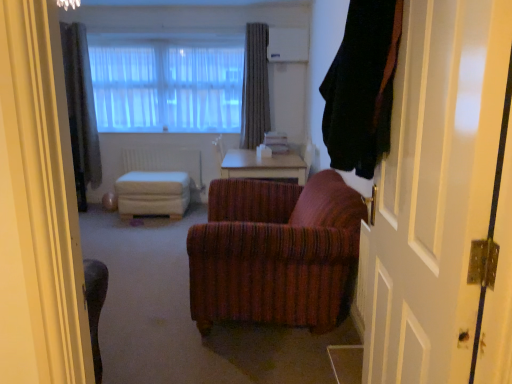
What is the approximate height of light brown wooden table at center?

It is 18.12 inches.

Where is `white matte radiator at center`? The height and width of the screenshot is (384, 512). white matte radiator at center is located at coordinates (165, 161).

From the picture: Measure the distance between point [251,123] and camera.

Point [251,123] is 16.53 feet from camera.

Identify the location of white fabric ottoman at center. (153, 194).

You are a GUI agent. You are given a task and a screenshot of the screen. Output one action in this format:
    pyautogui.click(x=<x>, y=<y>)
    Task: Click on the light brown wooden table at center
    This screenshot has height=384, width=512.
    Given the screenshot: What is the action you would take?
    pyautogui.click(x=263, y=166)

In terms of size, does white painted wood door at right appear bigger or smaller than black fabric curtain at right, which appears as the 1th curtain when viewed from the right?

white painted wood door at right is bigger than black fabric curtain at right, which appears as the 1th curtain when viewed from the right.

Does point (420, 382) come behind point (349, 44)?

No, (420, 382) is closer to viewer.

From a real-world perspective, which is physically below, white painted wood door at right or black fabric curtain at right, positioned as the 3th curtain in left-to-right order?

white painted wood door at right, from a real-world perspective.

What's the angular difference between white painted wood door at right and black fabric curtain at right, which is counted as the third curtain, starting from the back,'s facing directions?

They differ by 10.1 degrees in their facing directions.

Is gray textured curtain at upper center, arranged as the first curtain when viewed from the back, aimed at gray textured curtain at upper left, placed as the third curtain when sorted from right to left?

No, gray textured curtain at upper center, arranged as the first curtain when viewed from the back, does not turn towards gray textured curtain at upper left, placed as the third curtain when sorted from right to left.

In terms of height, does gray textured curtain at upper center, placed as the 3th curtain when sorted from front to back, look taller or shorter compared to gray textured curtain at upper left, marked as the first curtain in a left-to-right arrangement?

Considering their sizes, gray textured curtain at upper center, placed as the 3th curtain when sorted from front to back, has less height than gray textured curtain at upper left, marked as the first curtain in a left-to-right arrangement.

Is gray textured curtain at upper center, arranged as the first curtain when viewed from the back, touching gray textured curtain at upper left, marked as the first curtain in a left-to-right arrangement?

gray textured curtain at upper center, arranged as the first curtain when viewed from the back, is not next to gray textured curtain at upper left, marked as the first curtain in a left-to-right arrangement, and they're not touching.

Considering the positions of objects gray textured curtain at upper center, placed as the 3th curtain when sorted from front to back, and gray textured curtain at upper left, marked as the 2th curtain in a back-to-front arrangement, in the image provided, who is more to the right, gray textured curtain at upper center, placed as the 3th curtain when sorted from front to back, or gray textured curtain at upper left, marked as the 2th curtain in a back-to-front arrangement,?

gray textured curtain at upper center, placed as the 3th curtain when sorted from front to back.

Is black fabric curtain at right, which appears as the 1th curtain when viewed from the right, oriented towards light brown wooden table at center?

No, black fabric curtain at right, which appears as the 1th curtain when viewed from the right, is not turned towards light brown wooden table at center.

Is the surface of black fabric curtain at right, positioned as the first curtain in front-to-back order, in direct contact with light brown wooden table at center?

No, black fabric curtain at right, positioned as the first curtain in front-to-back order, is not in contact with light brown wooden table at center.

From a real-world perspective, who is located higher, black fabric curtain at right, which appears as the 1th curtain when viewed from the right, or light brown wooden table at center?

From a 3D spatial view, black fabric curtain at right, which appears as the 1th curtain when viewed from the right, is above.

Does black fabric curtain at right, which is counted as the third curtain, starting from the back, have a lesser height compared to light brown wooden table at center?

No, black fabric curtain at right, which is counted as the third curtain, starting from the back, is not shorter than light brown wooden table at center.

Does black fabric curtain at right, positioned as the first curtain in front-to-back order, have a larger size compared to gray textured curtain at upper center, which is counted as the 2th curtain, starting from the right?

Yes, black fabric curtain at right, positioned as the first curtain in front-to-back order, is bigger than gray textured curtain at upper center, which is counted as the 2th curtain, starting from the right.

This screenshot has height=384, width=512. There is a gray textured curtain at upper center, which is counted as the 2th curtain, starting from the right. Identify the location of the 1st curtain below it (from a real-world perspective). (362, 87).

Considering the sizes of objects black fabric curtain at right, positioned as the 3th curtain in left-to-right order, and gray textured curtain at upper center, which is counted as the 2th curtain, starting from the left, in the image provided, who is taller, black fabric curtain at right, positioned as the 3th curtain in left-to-right order, or gray textured curtain at upper center, which is counted as the 2th curtain, starting from the left,?

Standing taller between the two is gray textured curtain at upper center, which is counted as the 2th curtain, starting from the left.

Between light brown wooden table at center and white painted wood door at right, which one appears on the right side from the viewer's perspective?

white painted wood door at right.

Is the depth of light brown wooden table at center less than that of white painted wood door at right?

No, the depth of light brown wooden table at center is greater than that of white painted wood door at right.

Is light brown wooden table at center bigger or smaller than white painted wood door at right?

light brown wooden table at center is bigger than white painted wood door at right.

From a real-world perspective, is light brown wooden table at center beneath white painted wood door at right?

Correct, in the physical world, light brown wooden table at center is lower than white painted wood door at right.

Is white fabric ottoman at center not within light brown wooden table at center?

That's correct, white fabric ottoman at center is outside of light brown wooden table at center.

Is white fabric ottoman at center behind light brown wooden table at center?

A: Yes, white fabric ottoman at center is further from the viewer.

In the image, is white fabric ottoman at center on the left side or the right side of light brown wooden table at center?

Clearly, white fabric ottoman at center is on the left of light brown wooden table at center in the image.

From the picture: Which of these two, black fabric curtain at right, positioned as the first curtain in front-to-back order, or white painted wood door at right, is thinner?

white painted wood door at right is thinner.

From a real-world perspective, relative to white painted wood door at right, is black fabric curtain at right, which appears as the 1th curtain when viewed from the right, vertically above or below?

From a real-world perspective, black fabric curtain at right, which appears as the 1th curtain when viewed from the right, is physically above white painted wood door at right.

Can you confirm if black fabric curtain at right, which is counted as the third curtain, starting from the back, is shorter than white painted wood door at right?

Correct, black fabric curtain at right, which is counted as the third curtain, starting from the back, is not as tall as white painted wood door at right.

In the scene shown: Does black fabric curtain at right, which appears as the 1th curtain when viewed from the right, touch white painted wood door at right?

No, black fabric curtain at right, which appears as the 1th curtain when viewed from the right, is not touching white painted wood door at right.

From a real-world perspective, which curtain is the 2nd one above the white painted wood door at right? Please provide its 2D coordinates.

[(362, 87)]

Identify the location of the 1st curtain in front of the gray textured curtain at upper center, which is counted as the 2th curtain, starting from the right. (81, 110).

Based on their spatial positions, is white fabric ottoman at center or light brown wooden table at center further from white painted wood door at right?

Among the two, white fabric ottoman at center is located further to white painted wood door at right.

Looking at the image, which one is located closer to white fabric ottoman at center, light brown wooden table at center or white matte radiator at center?

The object closer to white fabric ottoman at center is white matte radiator at center.

From the image, which object appears to be farther from gray textured curtain at upper left, marked as the first curtain in a left-to-right arrangement, light brown wooden table at center or translucent fabric at upper center?

light brown wooden table at center is positioned further to the anchor gray textured curtain at upper left, marked as the first curtain in a left-to-right arrangement.

Looking at this image, which object lies further to the anchor point gray textured curtain at upper center, which is counted as the 2th curtain, starting from the right, white matte radiator at center or white fabric ottoman at center?

Based on the image, white fabric ottoman at center appears to be further to gray textured curtain at upper center, which is counted as the 2th curtain, starting from the right.

Which object lies further to the anchor point translucent fabric at upper center, white matte radiator at center or black fabric curtain at right, which appears as the 1th curtain when viewed from the right?

Based on the image, black fabric curtain at right, which appears as the 1th curtain when viewed from the right, appears to be further to translucent fabric at upper center.

Which object lies further to the anchor point white matte radiator at center, black fabric curtain at right, which appears as the 1th curtain when viewed from the right, or translucent fabric at upper center?

Based on the image, black fabric curtain at right, which appears as the 1th curtain when viewed from the right, appears to be further to white matte radiator at center.

Which object lies nearer to the anchor point translucent fabric at upper center, black fabric curtain at right, which appears as the 1th curtain when viewed from the right, or gray textured curtain at upper center, placed as the 3th curtain when sorted from front to back?

gray textured curtain at upper center, placed as the 3th curtain when sorted from front to back, is positioned closer to the anchor translucent fabric at upper center.

Estimate the real-world distances between objects in this image. Which object is closer to gray textured curtain at upper left, marked as the first curtain in a left-to-right arrangement, white matte radiator at center or light brown wooden table at center?

The object closer to gray textured curtain at upper left, marked as the first curtain in a left-to-right arrangement, is white matte radiator at center.

The height and width of the screenshot is (384, 512). Find the location of `table between white painted wood door at right and white matte radiator at center along the z-axis`. table between white painted wood door at right and white matte radiator at center along the z-axis is located at coordinates (263, 166).

I want to click on curtain between white painted wood door at right and gray textured curtain at upper left, marked as the 2th curtain in a back-to-front arrangement, from front to back, so click(x=362, y=87).

Locate an element on the screen. The image size is (512, 384). stool between black fabric curtain at right, which is counted as the third curtain, starting from the back, and white matte radiator at center from front to back is located at coordinates (153, 194).

Locate an element on the screen. table between translucent fabric at upper center and white fabric ottoman at center from top to bottom is located at coordinates (263, 166).